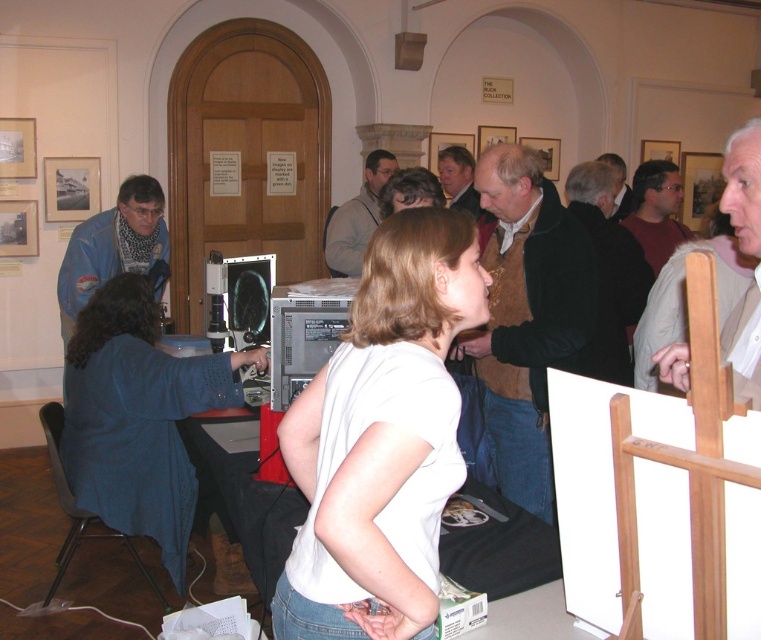
You are attending an art exhibition and notice two people in the scene described. The woman in the white matte shirt at center and the person in the blue sweater at left. Based on their positions, which person is closer to the front of the room?

The white matte shirt at center is above the blue sweater at left, indicating that the person in the white matte shirt at center is closer to the front of the room.